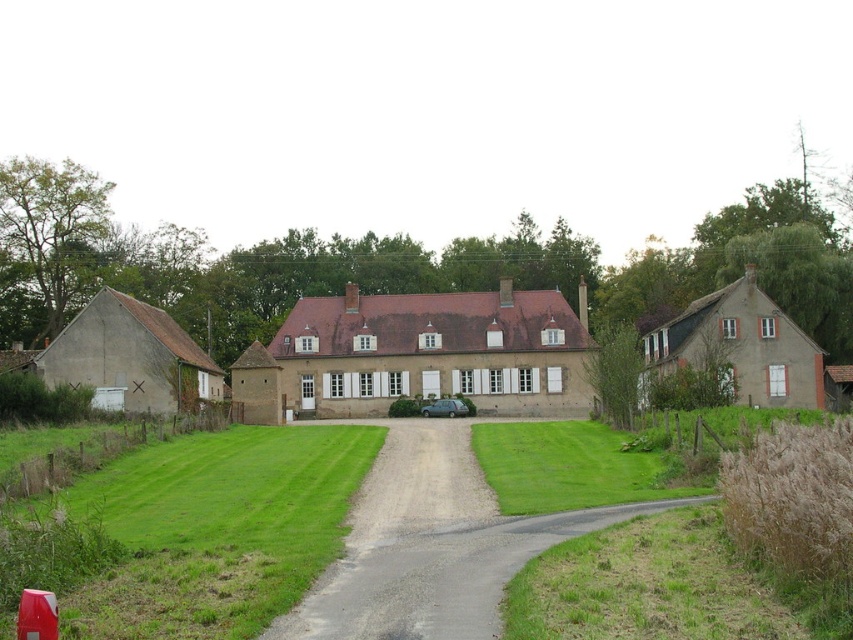
Question: Does green grass at lower left have a lesser width compared to metallic gray car at center?

Choices:
 (A) no
 (B) yes

Answer: (A)

Question: Based on their relative distances, which object is farther from the dirt/gravel driveway at center?

Choices:
 (A) metallic gray car at center
 (B) green grass at lower left

Answer: (A)

Question: From the image, what is the correct spatial relationship of green grass at lower left in relation to metallic gray car at center?

Choices:
 (A) above
 (B) below

Answer: (A)

Question: Which object appears farthest from the camera in this image?

Choices:
 (A) metallic gray car at center
 (B) dirt/gravel driveway at center
 (C) green grass at lower left

Answer: (A)

Question: Which of the following is the farthest from the observer?

Choices:
 (A) (463, 406)
 (B) (245, 600)

Answer: (A)

Question: Does green grass at lower left appear on the right side of metallic gray car at center?

Choices:
 (A) yes
 (B) no

Answer: (B)